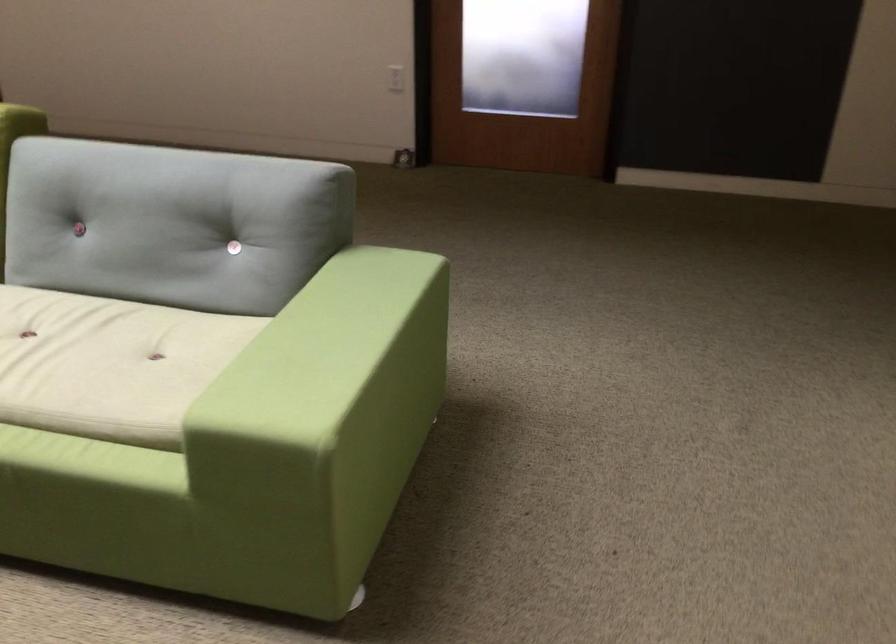
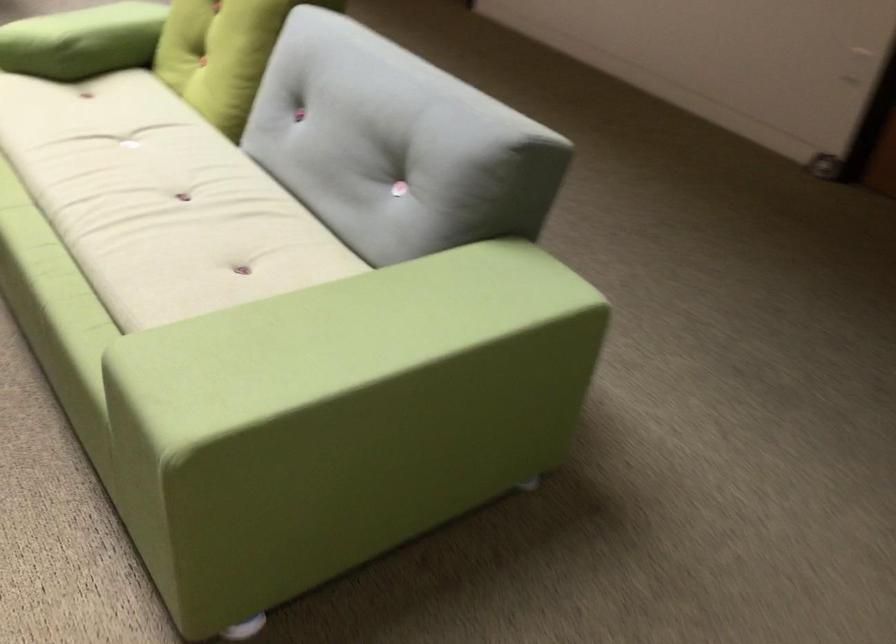
Question: The camera is either moving clockwise (left) or counter-clockwise (right) around the object. The first image is from the beginning of the video and the second image is from the end. Is the camera moving left or right when shooting the video?

Choices:
 (A) Left
 (B) Right

Answer: (B)